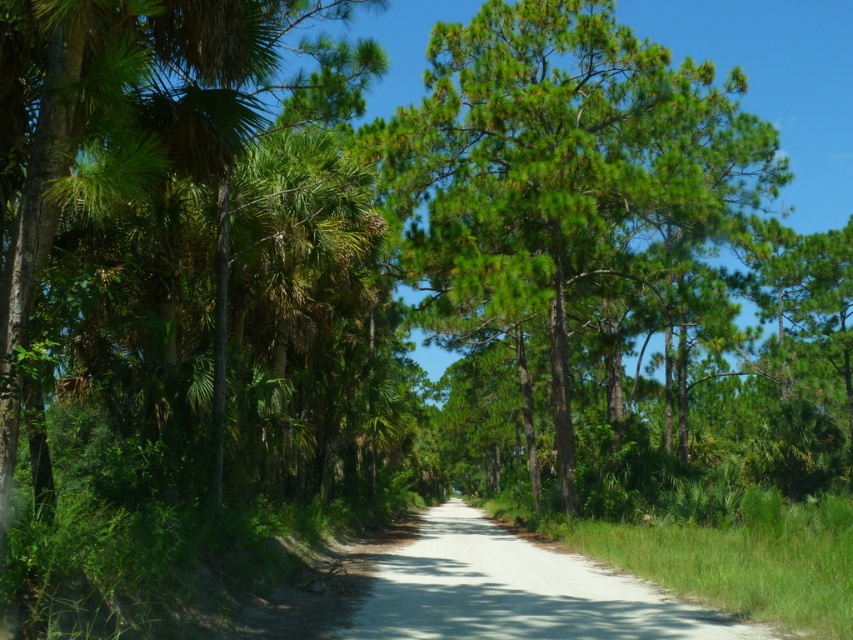
Can you confirm if green needle-like at center is bigger than gravel road at center?

Yes.

Is green needle-like at center above gravel road at center?

Yes.

Is point (483, 129) positioned in front of point (462, 586)?

That is False.

Where is `green needle-like at center`? green needle-like at center is located at coordinates pyautogui.click(x=563, y=180).